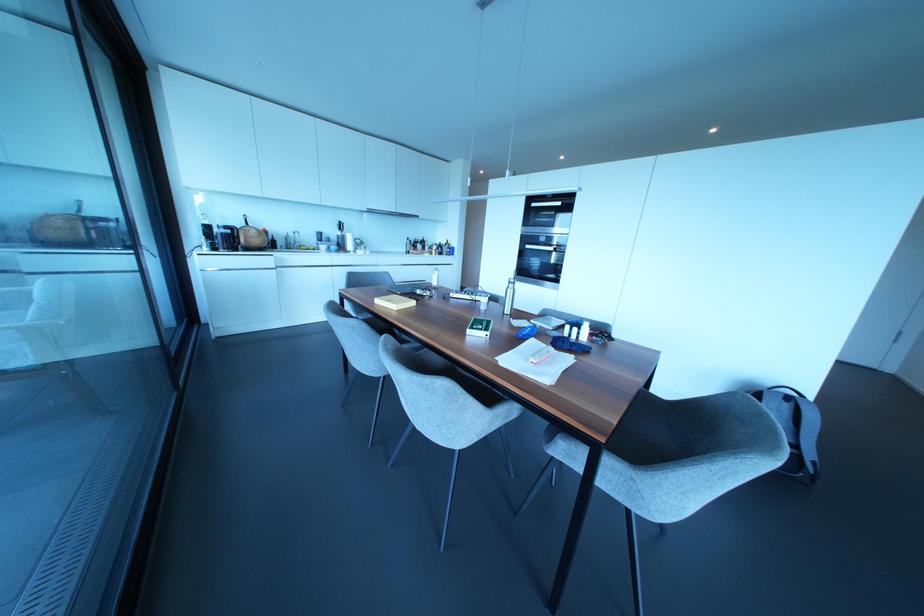
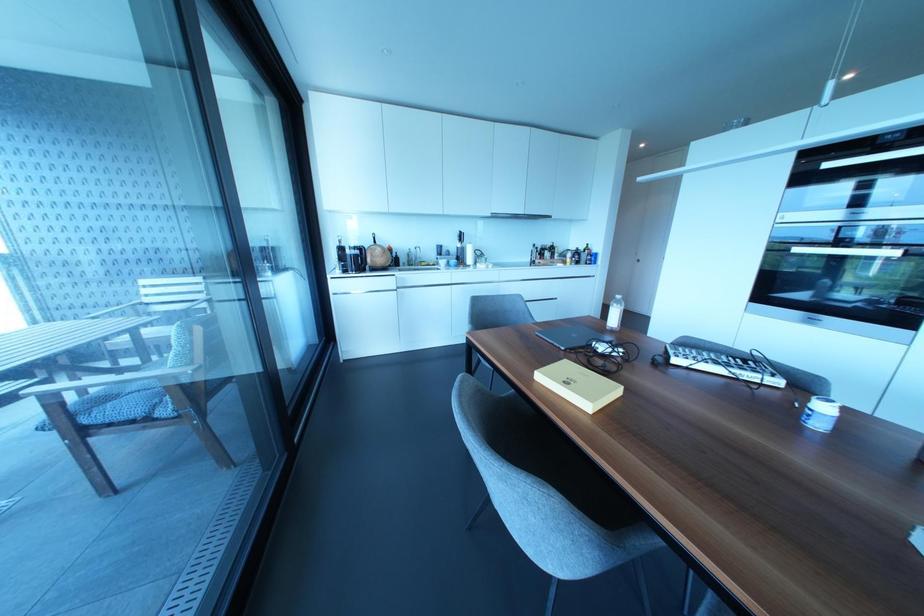
Question: Based on the continuous images, in which direction is the camera rotating? Reply with the corresponding letter.

Choices:
 (A) Left
 (B) Right
 (C) Up
 (D) Down

Answer: (A)